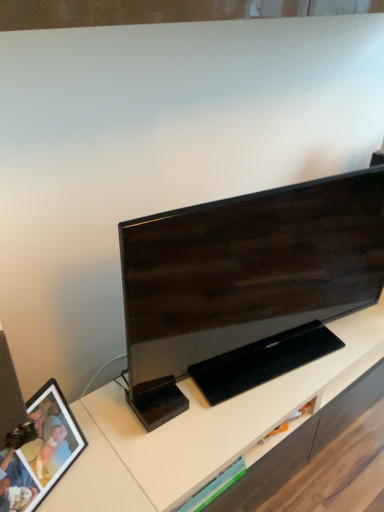
What do you see at coordinates (41, 450) in the screenshot? The width and height of the screenshot is (384, 512). I see `matte black picture frame at lower left` at bounding box center [41, 450].

Image resolution: width=384 pixels, height=512 pixels. I want to click on matte black picture frame at lower left, so click(x=41, y=450).

What do you see at coordinates (246, 287) in the screenshot?
I see `matte black tv at center` at bounding box center [246, 287].

Locate an element on the screen. matte black tv at center is located at coordinates (246, 287).

I want to click on matte black picture frame at lower left, so click(x=41, y=450).

Considering the relative positions of matte black picture frame at lower left and matte black tv at center in the image provided, is matte black picture frame at lower left to the left or to the right of matte black tv at center?

From the image, it's evident that matte black picture frame at lower left is to the left of matte black tv at center.

Is matte black picture frame at lower left further to camera compared to matte black tv at center?

No, it is not.

Considering the points (17, 466) and (298, 200), which point is in front, point (17, 466) or point (298, 200)?

The point (17, 466) is closer to the camera.

From the image's perspective, is matte black picture frame at lower left located above or below matte black tv at center?

matte black picture frame at lower left is below matte black tv at center.

From a real-world perspective, who is located lower, matte black picture frame at lower left or matte black tv at center?

From a 3D spatial view, matte black picture frame at lower left is below.

Between matte black picture frame at lower left and matte black tv at center, which one has larger width?

With larger width is matte black tv at center.

Based on the photo, who is taller, matte black picture frame at lower left or matte black tv at center?

With more height is matte black tv at center.

Can you confirm if matte black picture frame at lower left is bigger than matte black tv at center?

No.

Choose the correct answer: Is matte black picture frame at lower left inside matte black tv at center or outside it?

matte black picture frame at lower left lies outside matte black tv at center.

Is matte black picture frame at lower left not near matte black tv at center?

matte black picture frame at lower left is actually quite close to matte black tv at center.

Is matte black picture frame at lower left aimed at matte black tv at center?

No, matte black picture frame at lower left is not turned towards matte black tv at center.

Identify the location of television on the right of the matte black picture frame at lower left. click(246, 287).

Considering the positions of objects matte black tv at center and matte black picture frame at lower left in the image provided, who is more to the right, matte black tv at center or matte black picture frame at lower left?

matte black tv at center.

Who is more distant, matte black tv at center or matte black picture frame at lower left?

Positioned behind is matte black tv at center.

Is point (135, 228) closer or farther from the camera than point (66, 405)?

Point (135, 228).

From the image's perspective, is matte black tv at center located beneath matte black picture frame at lower left?

Incorrect, from the image's perspective, matte black tv at center is higher than matte black picture frame at lower left.

From a real-world perspective, is matte black tv at center below matte black picture frame at lower left?

No, from a real-world perspective, matte black tv at center is not below matte black picture frame at lower left.

Between matte black tv at center and matte black picture frame at lower left, which one has larger width?

matte black tv at center.

Considering the sizes of objects matte black tv at center and matte black picture frame at lower left in the image provided, who is taller, matte black tv at center or matte black picture frame at lower left?

With more height is matte black tv at center.

Between matte black tv at center and matte black picture frame at lower left, which one has smaller size?

Smaller between the two is matte black picture frame at lower left.

Can matte black picture frame at lower left be found inside matte black tv at center?

No, matte black picture frame at lower left is located outside of matte black tv at center.

Is matte black tv at center next to matte black picture frame at lower left?

matte black tv at center and matte black picture frame at lower left are clearly separated.

Could you tell me if matte black tv at center is turned towards matte black picture frame at lower left?

No, matte black tv at center is not turned towards matte black picture frame at lower left.

How much distance is there between matte black tv at center and matte black picture frame at lower left?

They are 20.41 inches apart.

In the image, there is a matte black picture frame at lower left. Where is `television above it (from the image's perspective)`? This screenshot has width=384, height=512. television above it (from the image's perspective) is located at coordinates (246, 287).

The height and width of the screenshot is (512, 384). What are the coordinates of `picture frame that is below the matte black tv at center (from the image's perspective)` in the screenshot? It's located at (41, 450).

I want to click on picture frame on the left of matte black tv at center, so click(x=41, y=450).